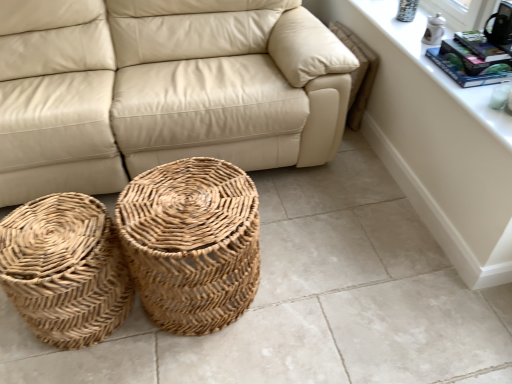
Question: From a real-world perspective, does white glossy dresser at upper right stand above white ceramic window sill at upper right?

Choices:
 (A) yes
 (B) no

Answer: (B)

Question: Is white glossy dresser at upper right wider than white ceramic window sill at upper right?

Choices:
 (A) no
 (B) yes

Answer: (A)

Question: Can you confirm if white glossy dresser at upper right is taller than white ceramic window sill at upper right?

Choices:
 (A) yes
 (B) no

Answer: (A)

Question: Can you confirm if white glossy dresser at upper right is thinner than white ceramic window sill at upper right?

Choices:
 (A) yes
 (B) no

Answer: (A)

Question: From the image's perspective, is white glossy dresser at upper right beneath white ceramic window sill at upper right?

Choices:
 (A) no
 (B) yes

Answer: (B)

Question: In terms of width, does white ceramic window sill at upper right look wider or thinner when compared to natural woven basket at lower left, the second basket from the right?

Choices:
 (A) thin
 (B) wide

Answer: (A)

Question: Is white ceramic window sill at upper right bigger or smaller than natural woven basket at lower left, the 1th basket positioned from the left?

Choices:
 (A) big
 (B) small

Answer: (B)

Question: From the image's perspective, is white ceramic window sill at upper right positioned above or below natural woven basket at lower left, the 1th basket positioned from the left?

Choices:
 (A) below
 (B) above

Answer: (B)

Question: Is white ceramic window sill at upper right inside the boundaries of natural woven basket at lower left, the second basket from the right, or outside?

Choices:
 (A) outside
 (B) inside

Answer: (A)

Question: Is point (176, 220) positioned closer to the camera than point (19, 288)?

Choices:
 (A) farther
 (B) closer

Answer: (A)

Question: Is natural woven basket at center, which appears as the 1th basket when viewed from the right, bigger or smaller than natural woven basket at lower left, the 1th basket positioned from the left?

Choices:
 (A) big
 (B) small

Answer: (A)

Question: Is natural woven basket at center, which is counted as the 2th basket, starting from the left, taller or shorter than natural woven basket at lower left, the 1th basket positioned from the left?

Choices:
 (A) short
 (B) tall

Answer: (B)

Question: Would you say natural woven basket at center, which is counted as the 2th basket, starting from the left, is to the left or to the right of natural woven basket at lower left, the 1th basket positioned from the left, in the picture?

Choices:
 (A) left
 (B) right

Answer: (B)

Question: Considering the positions of point [209, 150] and point [434, 89], is point [209, 150] closer or farther from the camera than point [434, 89]?

Choices:
 (A) farther
 (B) closer

Answer: (A)

Question: Is beige leather couch at center in front of or behind white glossy dresser at upper right in the image?

Choices:
 (A) behind
 (B) front

Answer: (A)